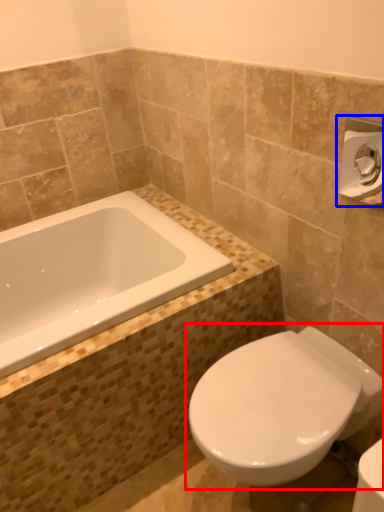
Question: Which object is closer to the camera taking this photo, toilet (highlighted by a red box) or towel bar (highlighted by a blue box)?

Choices:
 (A) toilet
 (B) towel bar

Answer: (B)